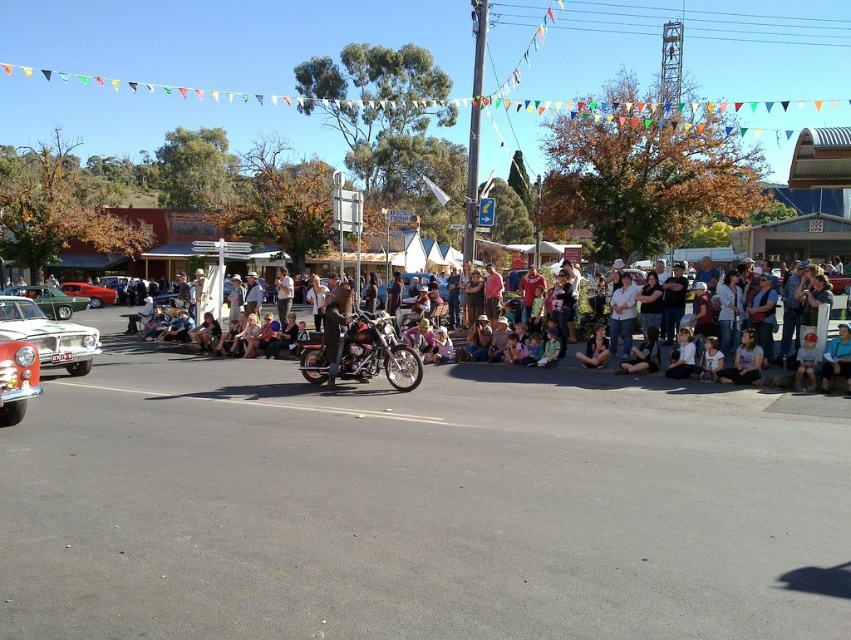
You are a photographer standing at the center of the street during the event. You want to take a photo of the light blue denim jeans at lower center without the white glossy car at left blocking the view. Which direction should you move to ensure the car is out of frame?

The white glossy car at left is positioned on the left side of light blue denim jeans at lower center. To avoid the car blocking the view, you should move to the right side of the light blue denim jeans at lower center so the car is no longer in the frame.

You are a delivery person needing to place a small package between the matte black motorcycle at center and the denim jacket at lower right. Can you fit the package there if it requires at least 1 meter of space?

The distance between the matte black motorcycle at center and the denim jacket at lower right is 1.01 meters, which is just enough to fit the package requiring at least 1 meter of space.

You are a photographer trying to capture both the white glossy car at left and the shiny chrome car at lower left in a single frame. Based on their sizes in the image, which car would appear bigger in your photo?

The white glossy car at left appears bigger in the photo because it has a larger size compared to the shiny chrome car at lower left.